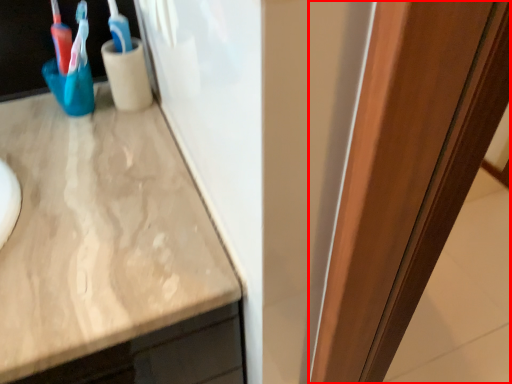
Question: In this image, where is glass door (annotated by the red box) located relative to toothbrush?

Choices:
 (A) right
 (B) left

Answer: (A)